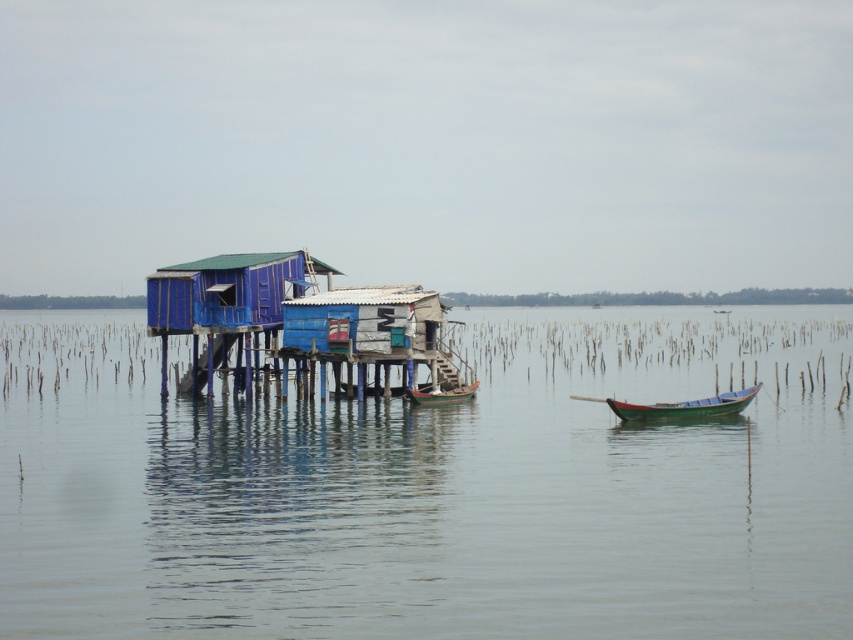
Question: Which object appears farthest from the camera in this image?

Choices:
 (A) wooden boat at center
 (B) clear water at house left

Answer: (A)

Question: Is clear water at house left above green wooden boat at right?

Choices:
 (A) yes
 (B) no

Answer: (A)

Question: Does clear water at house left have a smaller size compared to green wooden boat at right?

Choices:
 (A) yes
 (B) no

Answer: (B)

Question: Among these points, which one is farthest from the camera?

Choices:
 (A) (456, 499)
 (B) (218, 294)
 (C) (740, 403)
 (D) (425, 392)

Answer: (B)

Question: Is clear water at house left to the left of green wooden boat at right from the viewer's perspective?

Choices:
 (A) no
 (B) yes

Answer: (B)

Question: Which point is farther to the camera?

Choices:
 (A) green wooden boat at right
 (B) wooden boat at center

Answer: (B)